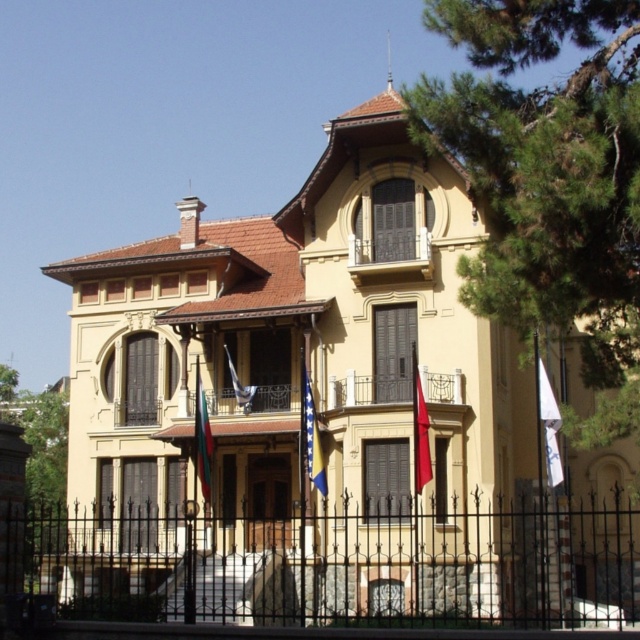
You are a visitor approaching the entrance of the two story building and see the red fabric flag at center and the striped fabric flag at center. Which flag is closer to you?

The red fabric flag at center is closer to you because it is positioned over the striped fabric flag at center, indicating it is in front.

You are a visitor approaching the entrance of the two story building. You see two flags in front of the entrance. Which flag is closer to the entrance, the red fabric flag at center or the striped fabric flag at center?

The red fabric flag at center is closer to the entrance because it is smaller than the striped fabric flag at center.

You are standing at the entrance of the building and want to walk to the green leafy tree at right while avoiding the blue fabric flag at center. Given that the distance between them is 23.04 meters, can you walk around the flag and reach the tree without getting too close?

The green leafy tree at right and blue fabric flag at center are 23.04 meters apart, so you can walk around the flag and reach the tree without getting too close as there is sufficient space between them.